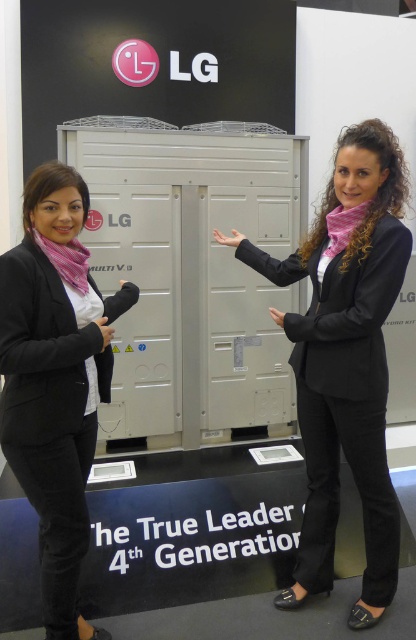
Question: Is metallic gray locker at center below matte black hand at center?

Choices:
 (A) yes
 (B) no

Answer: (B)

Question: Does matte black blazer at left have a greater width compared to black leather hand at center?

Choices:
 (A) no
 (B) yes

Answer: (B)

Question: Which point is farther to the camera?

Choices:
 (A) black smooth suit at center
 (B) matte black hand at center
 (C) skinny white hand at center

Answer: (C)

Question: Is matte black blazer at left further to camera compared to black leather hand at center?

Choices:
 (A) no
 (B) yes

Answer: (A)

Question: Which point is closer to the camera taking this photo?

Choices:
 (A) (240, 236)
 (B) (163, 371)
 (C) (103, 317)
 (D) (54, 520)

Answer: (D)

Question: Which is nearer to the matte black blazer at left?

Choices:
 (A) black smooth suit at center
 (B) matte black hand at center
 (C) black leather hand at center

Answer: (C)